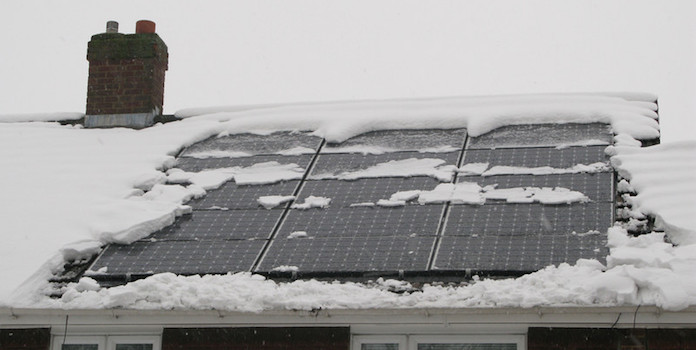
Locate an element on the screen. The width and height of the screenshot is (696, 350). 1 left pipe is located at coordinates (110, 24).